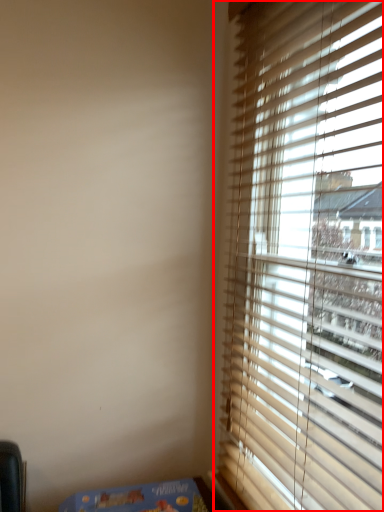
Question: Considering the relative positions of window (annotated by the red box) and table in the image provided, where is window (annotated by the red box) located with respect to the staircase?

Choices:
 (A) left
 (B) right

Answer: (B)